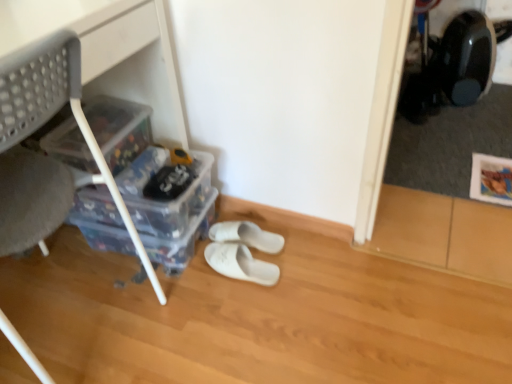
This screenshot has width=512, height=384. Identify the location of vacant space to the left of white fabric slippers at center, marked as the 2th footwear in a back-to-front arrangement. (182, 282).